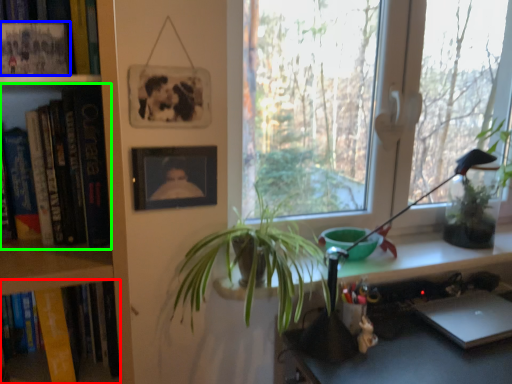
Question: Which object is positioned closest to book (highlighted by a red box)? Select from book (highlighted by a blue box) and book (highlighted by a green box).

Choices:
 (A) book
 (B) book

Answer: (B)